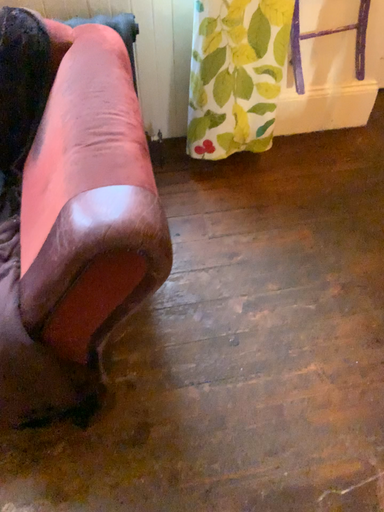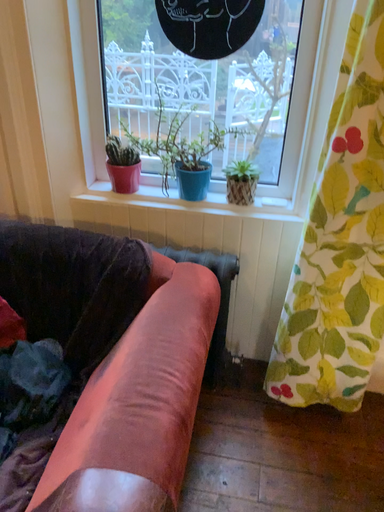
Question: How did the camera likely rotate when shooting the video?

Choices:
 (A) rotated downward
 (B) rotated upward

Answer: (B)